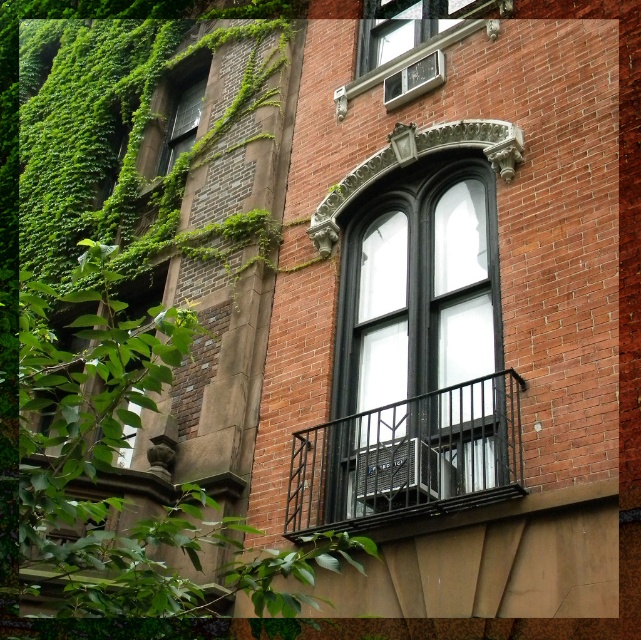
Is black metal balcony at center thinner than green mossy wall at upper left?

No, black metal balcony at center is not thinner than green mossy wall at upper left.

Between point (317, 477) and point (190, 122), which one is positioned behind?

Point (190, 122)

This screenshot has height=640, width=641. Find the location of `black metal balcony at center`. black metal balcony at center is located at coordinates (408, 458).

Does point (353, 444) come in front of point (369, 54)?

That is True.

Locate an element on the screen. black glass window at center is located at coordinates (415, 337).

Where is `black glass window at center`? Image resolution: width=641 pixels, height=640 pixels. black glass window at center is located at coordinates (415, 337).

Does white glass window at upper center have a smaller size compared to green mossy wall at upper left?

Incorrect, white glass window at upper center is not smaller in size than green mossy wall at upper left.

Is white glass window at upper center thinner than green mossy wall at upper left?

No, white glass window at upper center is not thinner than green mossy wall at upper left.

Is point (420, 4) behind point (174, 129)?

No, it is in front of (174, 129).

At what (x,y) coordinates should I click in order to perform the action: click on white glass window at upper center. Please return your answer as a coordinate pair (x, y). Looking at the image, I should click on [x=413, y=38].